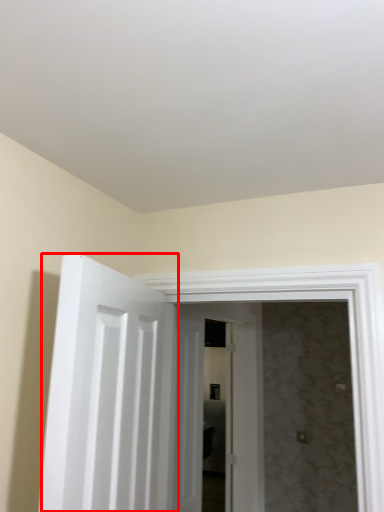
Question: From the image's perspective, what is the correct spatial positioning of door (annotated by the red box) in reference to door?

Choices:
 (A) above
 (B) below

Answer: (A)